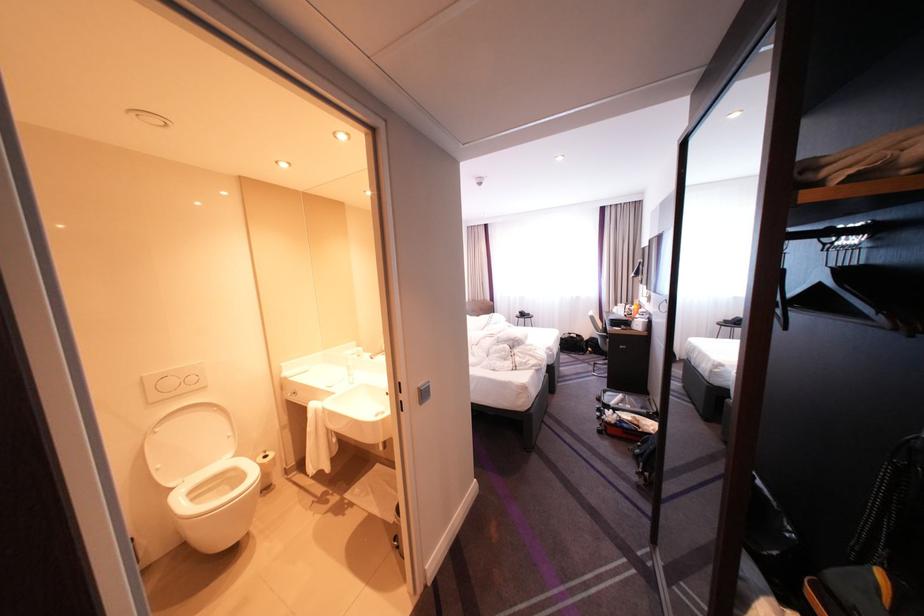
Identify the location of white hand towel. Image resolution: width=924 pixels, height=616 pixels. (319, 440).